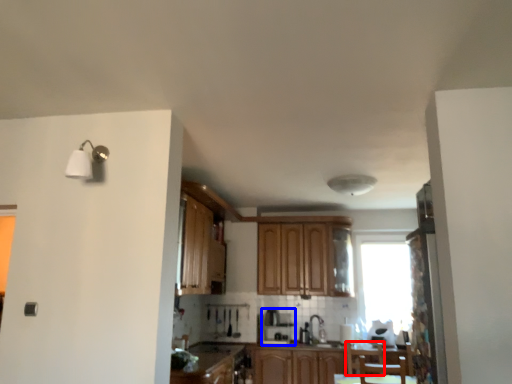
Question: Which object is further to the camera taking this photo, armchair (highlighted by a red box) or coffee machine (highlighted by a blue box)?

Choices:
 (A) armchair
 (B) coffee machine

Answer: (B)